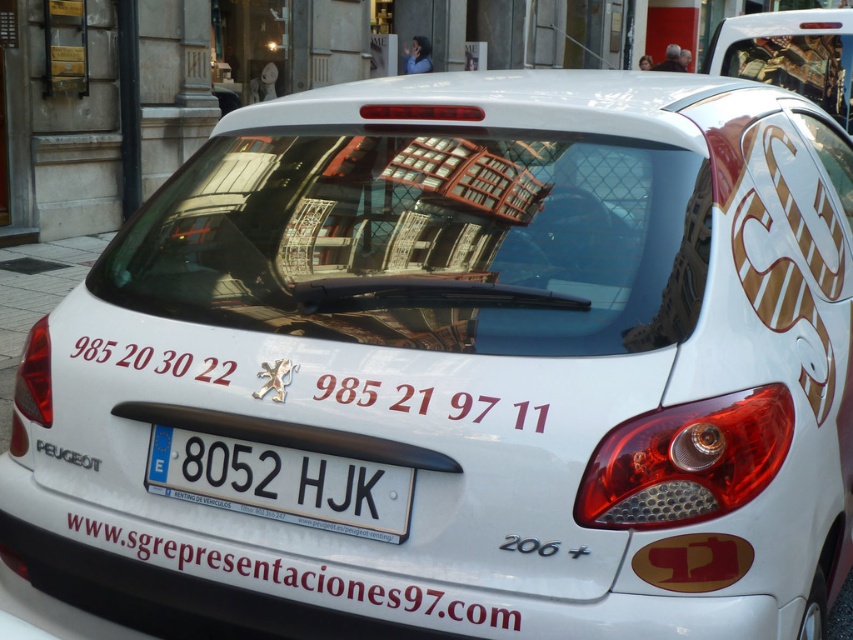
You are a driver trying to read the license plate of the white Peugeot 206 car from the rear. Where exactly is the white plastic license plate at center located on the car?

The white plastic license plate at center is located at point coordinates of (281, 483) on the car.

You are a delivery driver and need to deliver a package to the car with the license plate at point (x=281, y=483). Can you confirm the license plate number of the white Peugeot 206 car parked on the street?

The license plate at point (x=281, y=483) has the number 8052 HJK.